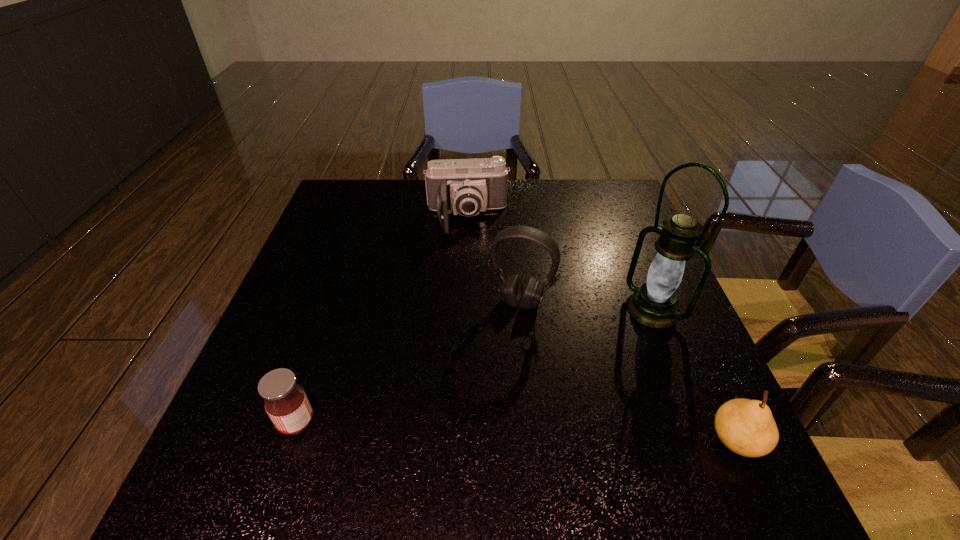
Locate an element on the screen. vacant space on the desktop that is between the jam and the pear and is positioned on the front-facing side of the headset is located at coordinates (473, 429).

This screenshot has height=540, width=960. Identify the location of free spot on the desktop that is between the leftmost object and the pear and is positioned at the front of the farthest object with an open lens cover. (482, 430).

The height and width of the screenshot is (540, 960). I want to click on free spot on the desktop that is between the leftmost object and the pear and is positioned on the side where the tallest object emits light, so click(x=510, y=431).